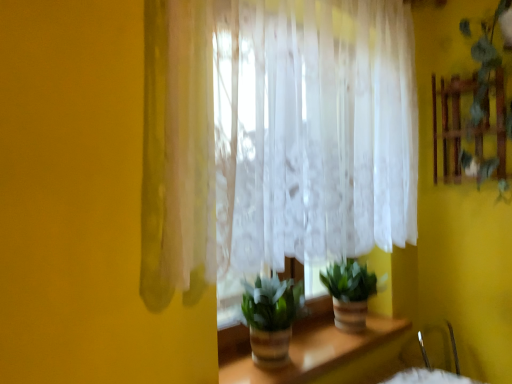
The image size is (512, 384). I want to click on translucent glass vase at center, so click(323, 354).

What do you see at coordinates (323, 354) in the screenshot? I see `translucent glass vase at center` at bounding box center [323, 354].

The image size is (512, 384). Describe the element at coordinates (274, 137) in the screenshot. I see `translucent white curtain at center` at that location.

At what (x,y) coordinates should I click in order to perform the action: click on green matte plant at center, which is counted as the first houseplant, starting from the left. Please return your answer as a coordinate pair (x, y). The height and width of the screenshot is (384, 512). Looking at the image, I should click on (271, 317).

Considering the sizes of green leafy plant at upper right and green matte plant at center, which is counted as the first houseplant, starting from the left, in the image, is green leafy plant at upper right wider or thinner than green matte plant at center, which is counted as the first houseplant, starting from the left,?

In the image, green leafy plant at upper right appears to be more narrow than green matte plant at center, which is counted as the first houseplant, starting from the left.

Is green leafy plant at upper right shorter than green matte plant at center, the first houseplant positioned from the front?

No.

Does green leafy plant at upper right turn towards green matte plant at center, which ranks as the 2th houseplant in back-to-front order?

No, green leafy plant at upper right is not aimed at green matte plant at center, which ranks as the 2th houseplant in back-to-front order.

How much distance is there between green leafy plant at upper right and green matte plant at center, the first houseplant positioned from the front?

green leafy plant at upper right and green matte plant at center, the first houseplant positioned from the front, are 4.09 feet apart.

Which of these two, translucent white curtain at center or green leafy plant at upper right, is thinner?

translucent white curtain at center.

Does translucent white curtain at center have a lesser height compared to green leafy plant at upper right?

In fact, translucent white curtain at center may be taller than green leafy plant at upper right.

How many degrees apart are the facing directions of translucent white curtain at center and green leafy plant at upper right?

The angular difference between translucent white curtain at center and green leafy plant at upper right is 90 degrees.

Between green matte plant at center, which is counted as the first houseplant, starting from the left, and translucent white curtain at center, which one appears on the left side from the viewer's perspective?

Positioned to the left is green matte plant at center, which is counted as the first houseplant, starting from the left.

From a real-world perspective, is green matte plant at center, marked as the 2th houseplant in a right-to-left arrangement, positioned over translucent white curtain at center based on gravity?

Incorrect, from a real-world perspective, green matte plant at center, marked as the 2th houseplant in a right-to-left arrangement, is lower than translucent white curtain at center.

Is green matte plant at center, the first houseplant positioned from the front, not within translucent white curtain at center?

Indeed, green matte plant at center, the first houseplant positioned from the front, is completely outside translucent white curtain at center.

Where is `table on the right of translucent white curtain at center`? The image size is (512, 384). table on the right of translucent white curtain at center is located at coordinates (323, 354).

Considering the sizes of objects translucent white curtain at center and translucent glass vase at center in the image provided, who is taller, translucent white curtain at center or translucent glass vase at center?

With more height is translucent white curtain at center.

Is point (302, 104) more distant than point (244, 357)?

No, (302, 104) is closer to viewer.

From the image's perspective, does translucent white curtain at center appear lower than translucent glass vase at center?

No.

Can you confirm if green matte plant at center, the first houseplant positioned from the front, is bigger than green matte plant at center, which is counted as the second houseplant, starting from the left?

No.

Is green matte plant at center, which ranks as the 2th houseplant in back-to-front order, with green matte plant at center, the first houseplant positioned from the right?

No, green matte plant at center, which ranks as the 2th houseplant in back-to-front order, is not in contact with green matte plant at center, the first houseplant positioned from the right.

From a real-world perspective, who is located lower, green matte plant at center, which is counted as the first houseplant, starting from the left, or green matte plant at center, the first houseplant positioned from the right?

green matte plant at center, the first houseplant positioned from the right.

Considering the sizes of objects translucent white curtain at center and green matte plant at center, marked as the 2th houseplant in a right-to-left arrangement, in the image provided, who is bigger, translucent white curtain at center or green matte plant at center, marked as the 2th houseplant in a right-to-left arrangement,?

translucent white curtain at center.

Which of these two, translucent white curtain at center or green matte plant at center, the first houseplant positioned from the front, is wider?

green matte plant at center, the first houseplant positioned from the front.

The width and height of the screenshot is (512, 384). Identify the location of the 1st houseplant positioned below the translucent white curtain at center (from a real-world perspective). (271, 317).

How much distance is there between translucent white curtain at center and green matte plant at center, marked as the 2th houseplant in a right-to-left arrangement?

translucent white curtain at center and green matte plant at center, marked as the 2th houseplant in a right-to-left arrangement, are 53.38 centimeters apart.

Which is less distant, (x=479, y=85) or (x=266, y=200)?

Point (x=479, y=85).

Is green leafy plant at upper right far away from translucent white curtain at center?

green leafy plant at upper right is near translucent white curtain at center, not far away.

I want to click on curtain in front of the green leafy plant at upper right, so click(274, 137).

Is green leafy plant at upper right not within translucent white curtain at center?

green leafy plant at upper right is positioned outside translucent white curtain at center.

Locate an element on the screen. This screenshot has height=384, width=512. houseplant that is the 2nd object to the left of the green leafy plant at upper right, starting at the anchor is located at coordinates (271, 317).

You are a GUI agent. You are given a task and a screenshot of the screen. Output one action in this format:
    pyautogui.click(x=<x>, y=<y>)
    Task: Click on the curtain below the green leafy plant at upper right (from a real-world perspective)
    The width and height of the screenshot is (512, 384).
    Given the screenshot: What is the action you would take?
    pyautogui.click(x=274, y=137)

Estimate the real-world distances between objects in this image. Which object is further from green matte plant at center, placed as the 2th houseplant when sorted from front to back, translucent white curtain at center or green leafy plant at upper right?

green leafy plant at upper right.

Considering their positions, is translucent glass vase at center positioned closer to green leafy plant at upper right than green matte plant at center, placed as the 2th houseplant when sorted from front to back?

green matte plant at center, placed as the 2th houseplant when sorted from front to back.

Consider the image. When comparing their distances from green matte plant at center, which is counted as the first houseplant, starting from the left, does green matte plant at center, which is counted as the second houseplant, starting from the left, or green leafy plant at upper right seem closer?

Based on the image, green matte plant at center, which is counted as the second houseplant, starting from the left, appears to be nearer to green matte plant at center, which is counted as the first houseplant, starting from the left.

When comparing their distances from green leafy plant at upper right, does translucent white curtain at center or translucent glass vase at center seem further?

translucent glass vase at center lies further to green leafy plant at upper right than the other object.

Based on their spatial positions, is translucent white curtain at center or green matte plant at center, which is counted as the first houseplant, starting from the left, further from green leafy plant at upper right?

Based on the image, green matte plant at center, which is counted as the first houseplant, starting from the left, appears to be further to green leafy plant at upper right.

From the image, which object appears to be farther from green leafy plant at upper right, translucent glass vase at center or translucent white curtain at center?

translucent glass vase at center.

From the picture: Based on their spatial positions, is green matte plant at center, which is counted as the second houseplant, starting from the left, or green matte plant at center, which is counted as the first houseplant, starting from the left, further from translucent white curtain at center?

Among the two, green matte plant at center, which is counted as the second houseplant, starting from the left, is located further to translucent white curtain at center.

From the image, which object appears to be farther from green matte plant at center, which is counted as the second houseplant, starting from the left, green leafy plant at upper right or green matte plant at center, the first houseplant positioned from the front?

green leafy plant at upper right.

Image resolution: width=512 pixels, height=384 pixels. In order to click on curtain between green leafy plant at upper right and green matte plant at center, the first houseplant positioned from the right, in the up-down direction in this screenshot , I will do `click(274, 137)`.

At what (x,y) coordinates should I click in order to perform the action: click on curtain between green leafy plant at upper right and translucent glass vase at center in the vertical direction. Please return your answer as a coordinate pair (x, y). Looking at the image, I should click on (274, 137).

I want to click on houseplant that lies between green leafy plant at upper right and green matte plant at center, the first houseplant positioned from the front, from top to bottom, so click(x=349, y=293).

Where is `houseplant between translucent white curtain at center and green matte plant at center, marked as the 2th houseplant in a right-to-left arrangement, in the up-down direction`? houseplant between translucent white curtain at center and green matte plant at center, marked as the 2th houseplant in a right-to-left arrangement, in the up-down direction is located at coordinates (349, 293).